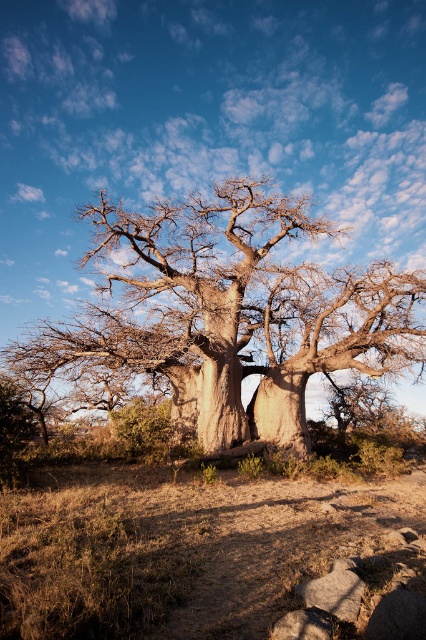
Between brown dry grass at lower center and smooth brown tree at center, which one is positioned lower?

brown dry grass at lower center is lower down.

Does brown dry grass at lower center have a smaller size compared to smooth brown tree at center?

Yes.

Is point (57, 541) closer to viewer compared to point (43, 328)?

Yes, it is.

At what (x,y) coordinates should I click in order to perform the action: click on brown dry grass at lower center. Please return your answer as a coordinate pair (x, y). Looking at the image, I should click on (201, 554).